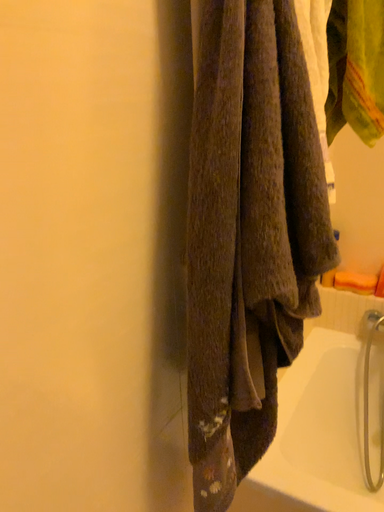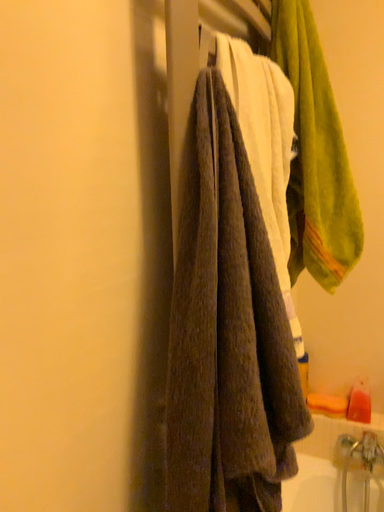
Question: Which way did the camera rotate in the video?

Choices:
 (A) rotated downward
 (B) rotated upward

Answer: (B)